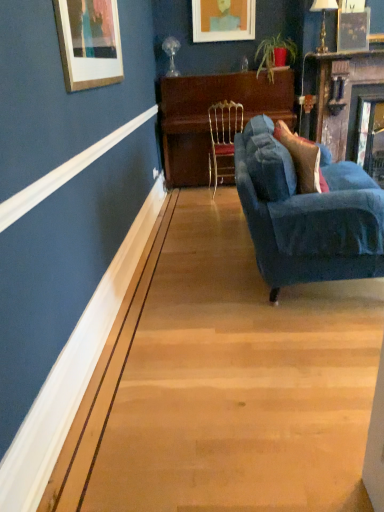
The image size is (384, 512). What are the coordinates of `free space in front of wooden piano at center` in the screenshot? It's located at (x=199, y=210).